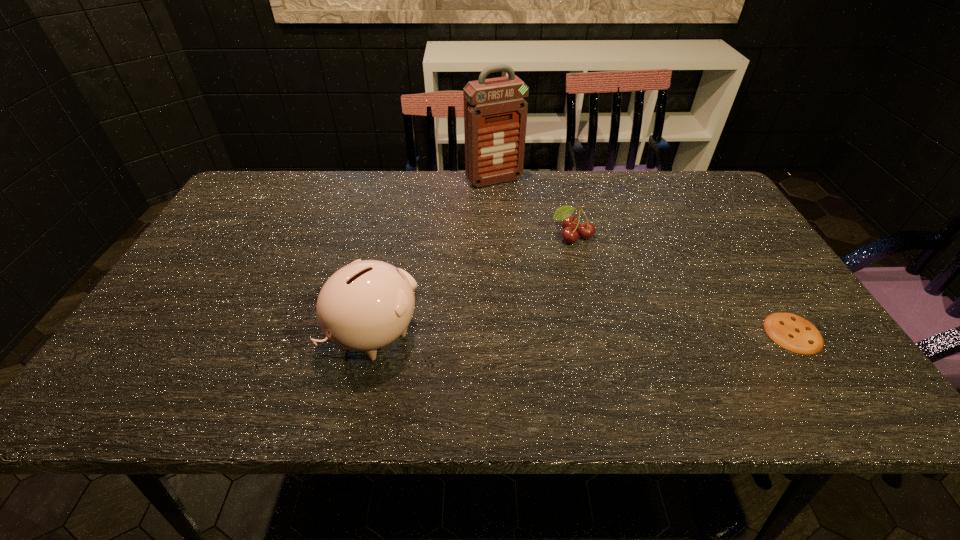
The image size is (960, 540). I want to click on object at the near right corner, so click(x=792, y=332).

I want to click on vacant point at the far edge, so click(x=532, y=197).

Image resolution: width=960 pixels, height=540 pixels. I want to click on vacant space at the near edge of the desktop, so click(x=324, y=352).

The height and width of the screenshot is (540, 960). In the image, there is a desktop. What are the coordinates of `free space at the left edge` in the screenshot? It's located at (217, 232).

Where is `vacant area at the right edge`? This screenshot has width=960, height=540. vacant area at the right edge is located at coordinates pyautogui.click(x=766, y=271).

I want to click on vacant area at the far left corner of the desktop, so click(256, 196).

In the image, there is a desktop. In order to click on vacant space at the near right corner in this screenshot , I will do `click(757, 336)`.

Where is `free space between the cookie and the tallest object`? This screenshot has width=960, height=540. free space between the cookie and the tallest object is located at coordinates (643, 256).

The width and height of the screenshot is (960, 540). I want to click on vacant area between the second shortest object and the second object from left to right, so click(x=533, y=208).

Where is `free space between the third shortest object and the shortest object`? The image size is (960, 540). free space between the third shortest object and the shortest object is located at coordinates (584, 333).